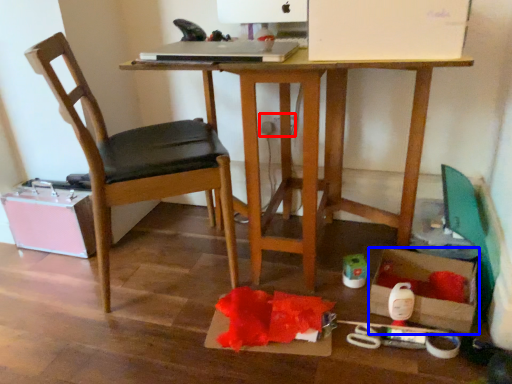
Question: Which of the following is the farthest to the observer, power plugs and sockets (highlighted by a red box) or storage box (highlighted by a blue box)?

Choices:
 (A) power plugs and sockets
 (B) storage box

Answer: (A)